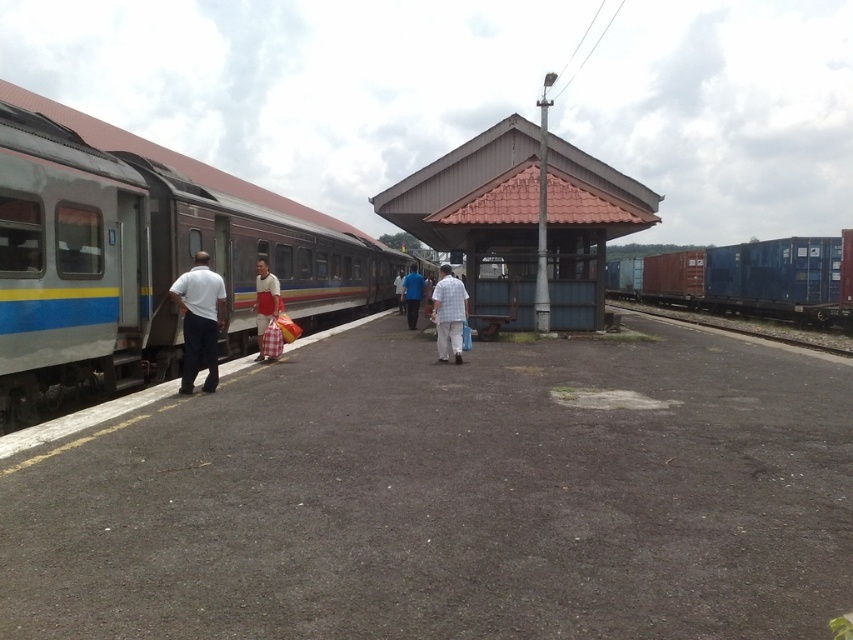
You are a passenger on the platform and have two bags with you, the white fabric bag at center and the blue fabric bag at center. You need to place both bags on the overhead compartment which has limited space. Which bag should you place first to ensure both fit?

Since the white fabric bag at center is narrower than the blue fabric bag at center, you should place the wider blue fabric bag at center first in the overhead compartment to make space for the narrower white fabric bag at center.

You are a railway worker who needs to place a new blue metallic train track at right next to the existing blue matte container at right. Based on the scene, will the track fit next to the container without overlapping?

The blue matte container at right is wider than the blue metallic train track at right, so the track can fit next to the container without overlapping since the container takes up more space.

You are standing on the platform at the railway station and see two points marked on the ground. The first point is at coordinates point (456, 298) and the second point is at point (277, 280). Which point is closer to your current position?

Point (456, 298) is closer to the camera than point (277, 280), so the first point is closer to your current position.